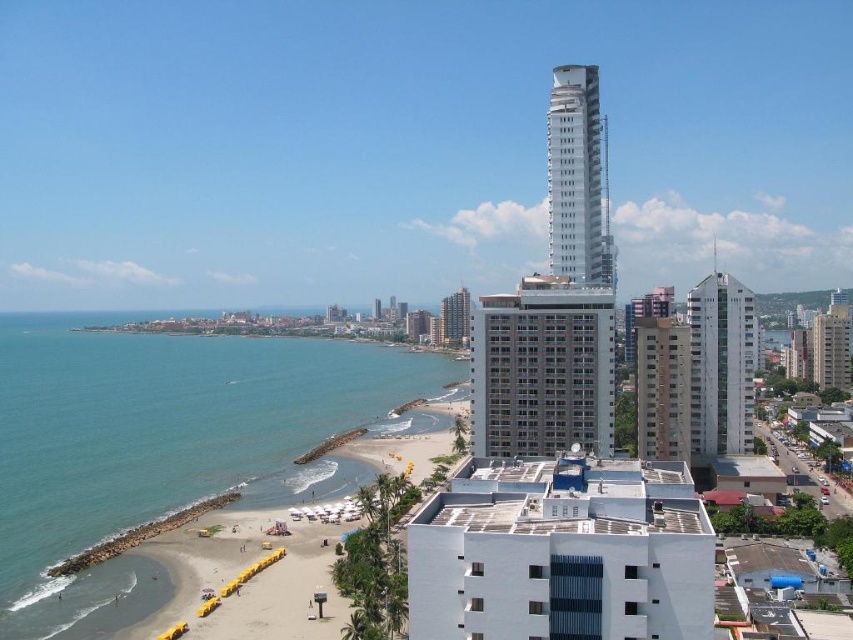
Question: Can you confirm if white smooth building at center is bigger than matte gray building at center?

Choices:
 (A) no
 (B) yes

Answer: (A)

Question: Among these objects, which one is nearest to the camera?

Choices:
 (A) white concrete building at center
 (B) blue water at beach left
 (C) white smooth tower at upper right

Answer: (B)

Question: Is white concrete building at center positioned in front of matte gray building at center?

Choices:
 (A) yes
 (B) no

Answer: (A)

Question: Which object is the farthest from the white smooth building at center-right?

Choices:
 (A) white smooth building at center
 (B) blue water at beach left

Answer: (B)

Question: Among these points, which one is farthest from the camera?

Choices:
 (A) (721, 369)
 (B) (519, 358)
 (C) (495, 481)
 (D) (450, 340)

Answer: (D)

Question: Where is white concrete building at center located in relation to white smooth building at center-right in the image?

Choices:
 (A) right
 (B) left

Answer: (B)